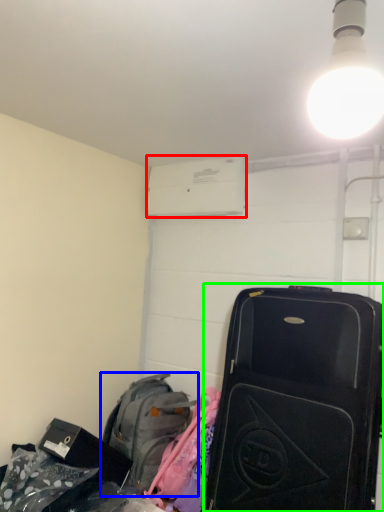
Question: Which is nearer to the air conditioning (highlighted by a red box)? luggage and bags (highlighted by a blue box) or suitcase (highlighted by a green box).

Choices:
 (A) luggage and bags
 (B) suitcase

Answer: (B)